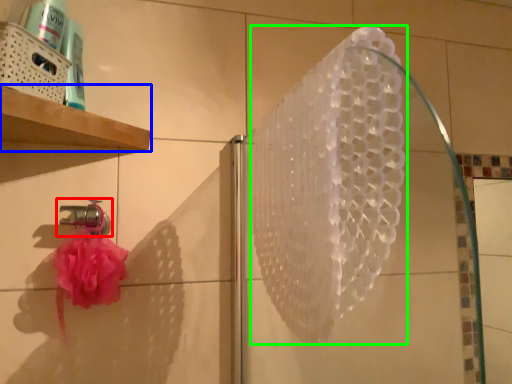
Question: Which object is positioned closest to tap (highlighted by a red box)? Select from shelf (highlighted by a blue box) and shower (highlighted by a green box).

Choices:
 (A) shelf
 (B) shower

Answer: (A)